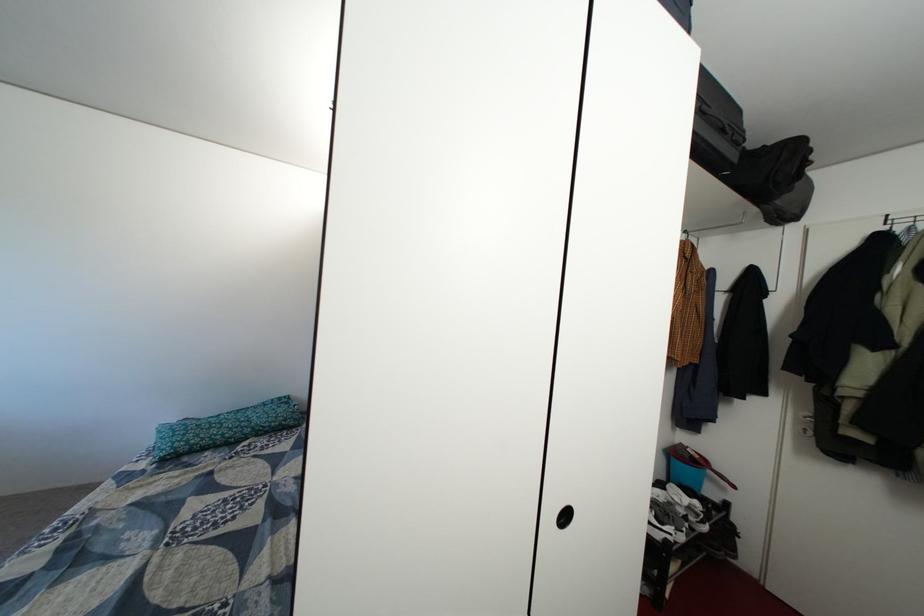
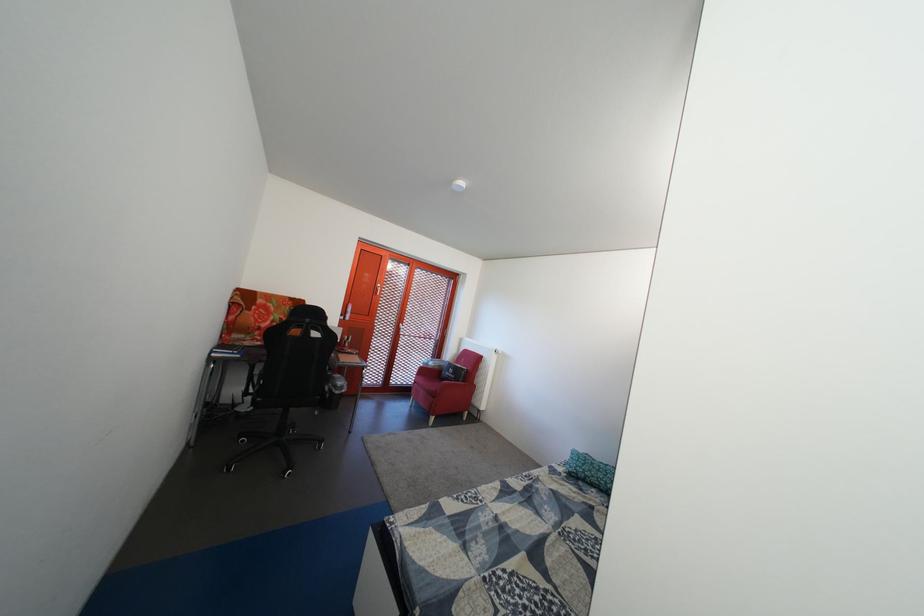
Question: The camera is either moving clockwise (left) or counter-clockwise (right) around the object. The first image is from the beginning of the video and the second image is from the end. Is the camera moving left or right when shooting the video?

Choices:
 (A) Left
 (B) Right

Answer: (B)